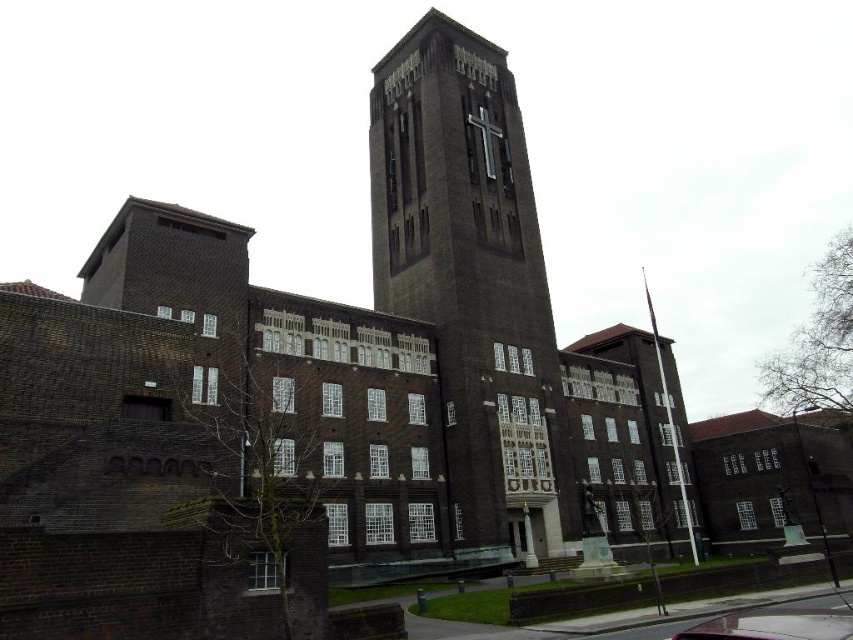
You are a pedestrian standing on the sidewalk in front of the brown brick tower at center. You want to cross the street to reach the park on the other side. Is the metallic pink car at lower center blocking your path to the park?

The metallic pink car at lower center is behind the brown brick tower at center, so it is not blocking your path to the park.

You are standing in front of the brown brick tower at center and want to see the metallic pink car at lower center. In which direction should you turn your head to look towards the car?

The brown brick tower at center is positioned on the left side of metallic pink car at lower center, so you should turn your head to the right to look towards the metallic pink car at lower center.

You are standing in front of a historical building and want to take a photo of the brown brick tower at center. If your camera can focus on objects up to 50 meters away, will you need to move closer to capture the tower clearly?

The brown brick tower at center is 54.69 meters from viewer, so you need to move closer to ensure it is within the camera focus range of 50 meters.